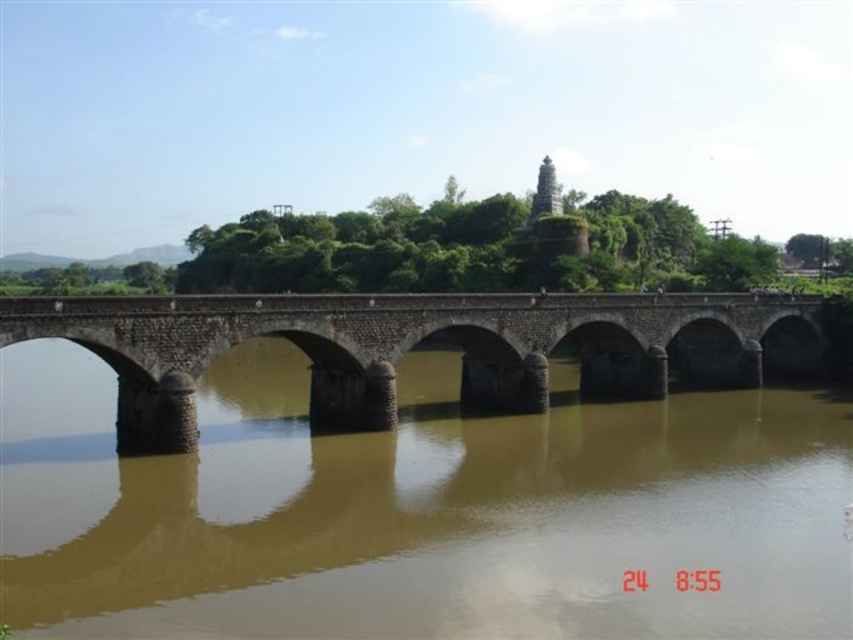
Who is shorter, brown stone river at center or brown stone bridge at center?

With less height is brown stone bridge at center.

Find the location of `brown stone river at center`. brown stone river at center is located at coordinates (418, 509).

The width and height of the screenshot is (853, 640). Identify the location of brown stone river at center. (418, 509).